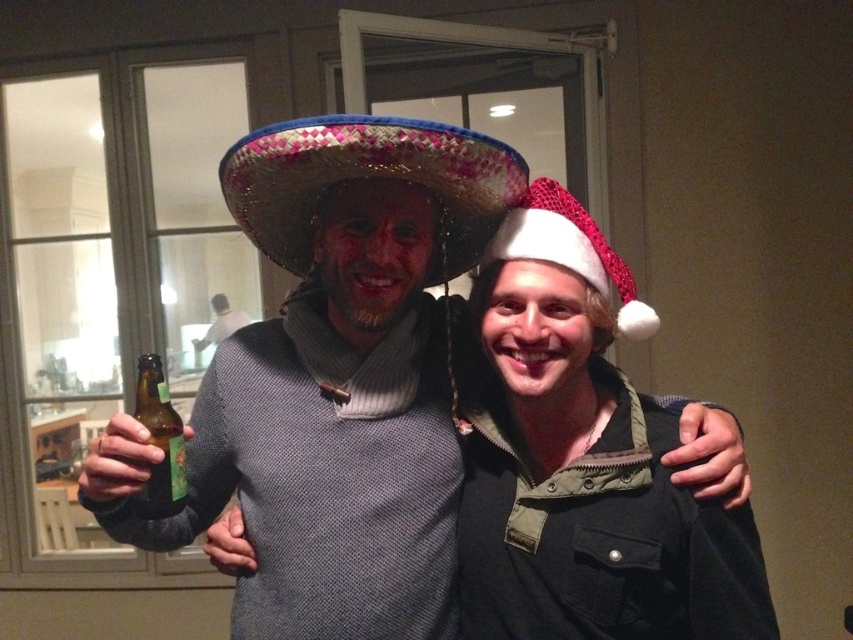
You are organizing a costume party and need to decide which sombrero to wear. The scene shows a bright pink woven sombrero at center and a fuzzy straw sombrero at right. Which sombrero is larger in size?

The bright pink woven sombrero at center is bigger than the fuzzy straw sombrero at right, so it is the larger option.